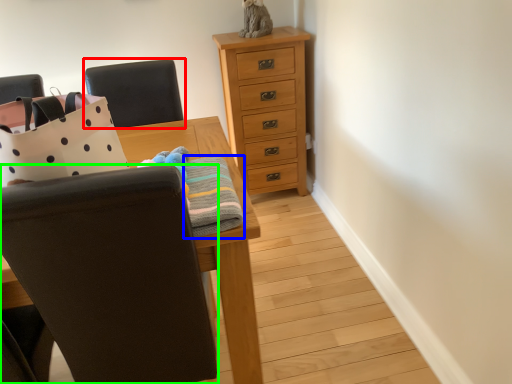
Question: Which is nearer to the chair (highlighted by a red box)? blanket (highlighted by a blue box) or chair (highlighted by a green box).

Choices:
 (A) blanket
 (B) chair

Answer: (A)